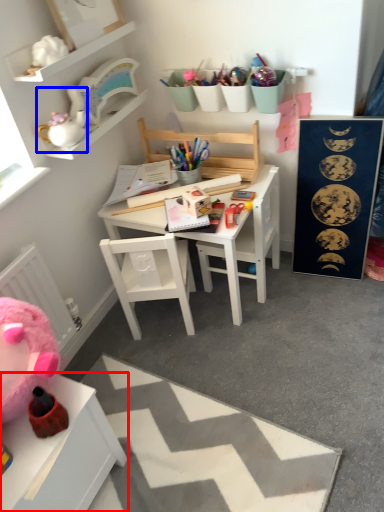
Question: Which object is closer to the camera taking this photo, table (highlighted by a red box) or toy (highlighted by a blue box)?

Choices:
 (A) table
 (B) toy

Answer: (A)